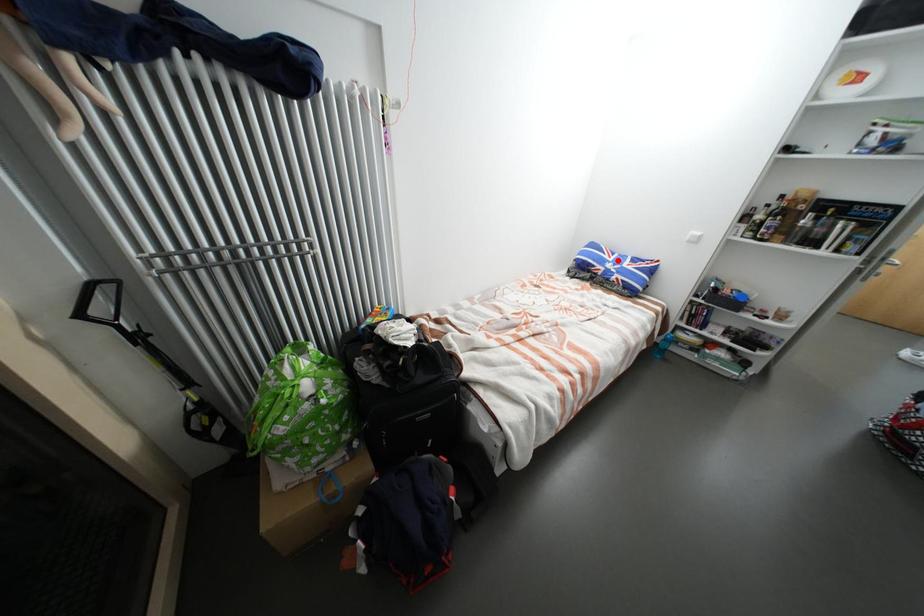
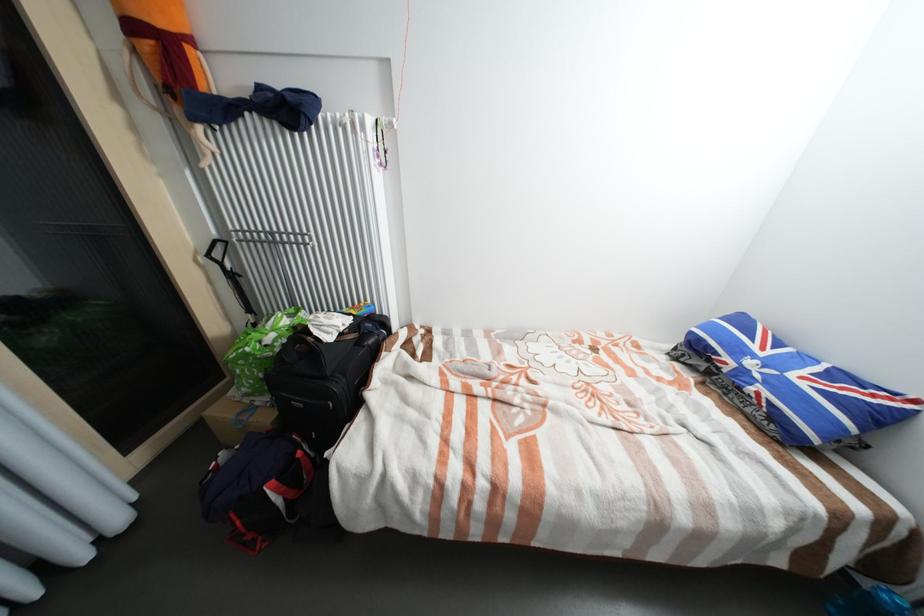
Where in the second image is the point corresponding to the highlighted location from the first image?

(769, 354)